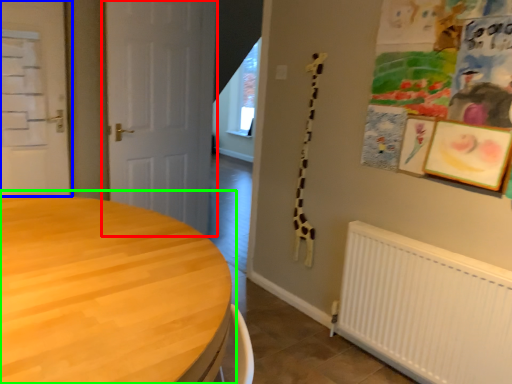
Question: Which is farther away from door (highlighted by a red box)? door (highlighted by a blue box) or table (highlighted by a green box)?

Choices:
 (A) door
 (B) table

Answer: (B)